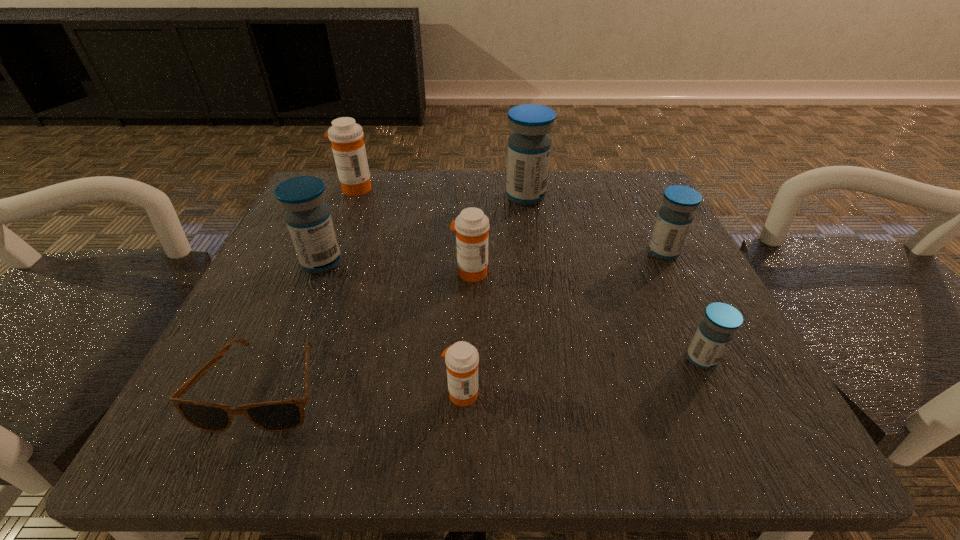
What are the coordinates of `empty space between the second biggest orange medicine and the third smallest blue medicine` in the screenshot? It's located at (396, 267).

Find the location of a particular element. vacant point located between the second nearest orange medicine and the nearest orange medicine is located at coordinates (467, 333).

At what (x,y) coordinates should I click in order to perform the action: click on empty location between the third smallest blue medicine and the second farthest orange medicine. Please return your answer as a coordinate pair (x, y). The width and height of the screenshot is (960, 540). Looking at the image, I should click on (396, 267).

Locate an element on the screen. The image size is (960, 540). vacant space that is in between the tallest medicine and the farthest orange medicine is located at coordinates (441, 193).

You are a GUI agent. You are given a task and a screenshot of the screen. Output one action in this format:
    pyautogui.click(x=<x>, y=<y>)
    Task: Click on the free space between the third blue medicine from right to left and the leftmost blue medicine
    
    Given the screenshot: What is the action you would take?
    pyautogui.click(x=423, y=230)

I want to click on vacant space that's between the second farthest orange medicine and the shortest object, so click(x=369, y=329).

Locate an element on the screen. This screenshot has width=960, height=540. free spot between the nearest blue medicine and the shortest object is located at coordinates (484, 373).

At what (x,y) coordinates should I click in order to perform the action: click on free area in between the third biggest blue medicine and the smallest orange medicine. Please return your answer as a coordinate pair (x, y). This screenshot has width=960, height=540. Looking at the image, I should click on (563, 322).

What are the coordinates of `free area in between the tallest medicine and the second smallest orange medicine` in the screenshot? It's located at (498, 234).

At what (x,y) coordinates should I click in order to perform the action: click on free spot between the farthest orange medicine and the second smallest orange medicine. Please return your answer as a coordinate pair (x, y). This screenshot has width=960, height=540. Looking at the image, I should click on (413, 231).